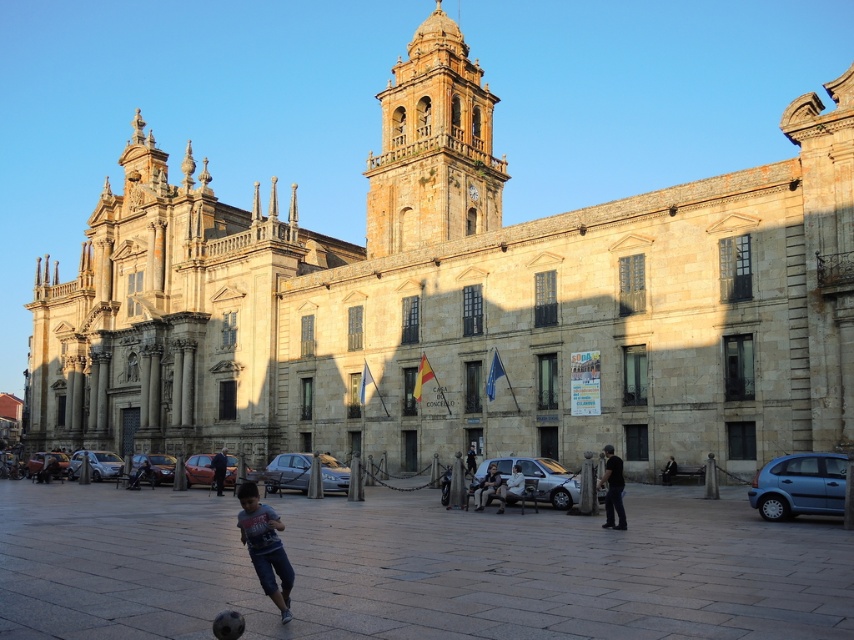
Does smooth stone pavement at center appear on the right side of light blue denim jeans at center?

Incorrect, smooth stone pavement at center is not on the right side of light blue denim jeans at center.

Is point (762, 576) closer to camera compared to point (499, 493)?

That is True.

Is point (721, 516) closer to viewer compared to point (521, 496)?

That is True.

Locate an element on the screen. smooth stone pavement at center is located at coordinates tap(416, 566).

Which of these two, blue cotton shirt at center or dark blue jeans at center, stands taller?

With more height is blue cotton shirt at center.

Which is behind, point (293, 577) or point (488, 486)?

The point (488, 486) is more distant.

Between point (237, 525) and point (487, 467), which one is positioned in front?

Point (237, 525) is in front.

Identify the location of blue cotton shirt at center. (265, 547).

Which is below, dark blue jeans at center or light blue denim jeans at center?

dark blue jeans at center

Who is more distant from viewer, [484,500] or [522,483]?

Point [484,500]

The width and height of the screenshot is (854, 640). Identify the location of dark blue jeans at center. (486, 486).